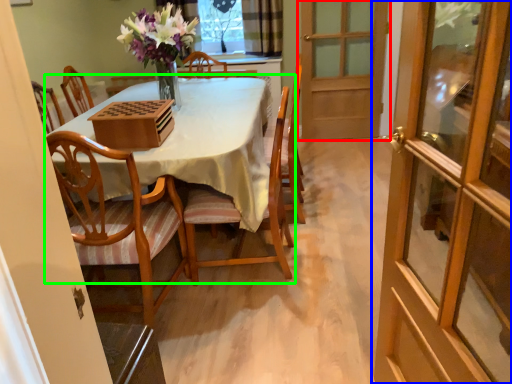
Question: Which is farther away from door (highlighted by a red box)? door (highlighted by a blue box) or kitchen & dining room table (highlighted by a green box)?

Choices:
 (A) door
 (B) kitchen & dining room table

Answer: (B)